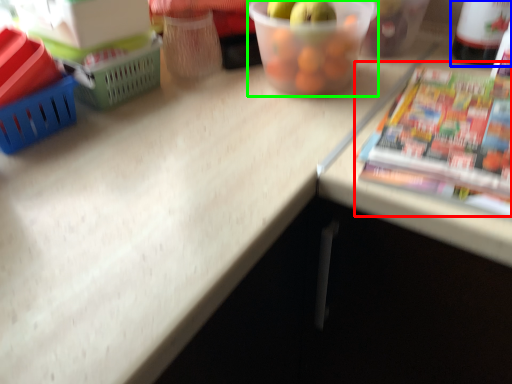
Question: Based on their relative distances, which object is farther from paperback book (highlighted by a red box)? Choose from bottle (highlighted by a blue box) and glass bowl (highlighted by a green box).

Choices:
 (A) bottle
 (B) glass bowl

Answer: (A)